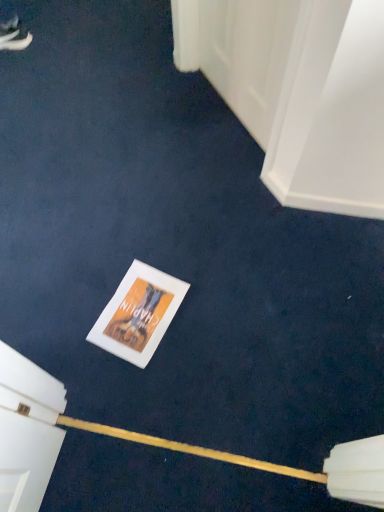
The width and height of the screenshot is (384, 512). In order to click on free location in front of white glossy picture frame at center in this screenshot , I will do `click(134, 391)`.